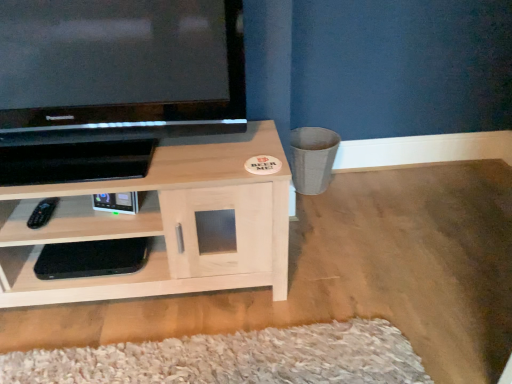
Find the location of a particular element. The image size is (512, 384). vacant space underneath black glossy television at upper left (from a real-world perspective) is located at coordinates (130, 163).